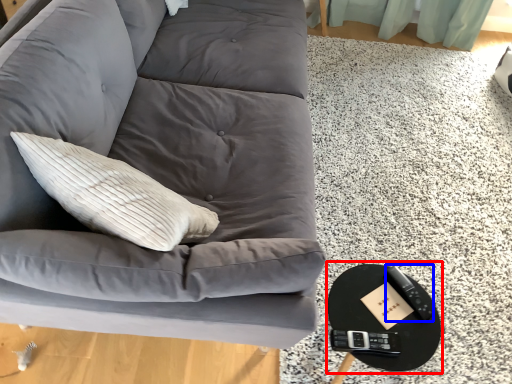
Question: Which object appears closest to the camera in this image, round table (highlighted by a red box) or remote (highlighted by a blue box)?

Choices:
 (A) round table
 (B) remote

Answer: (A)